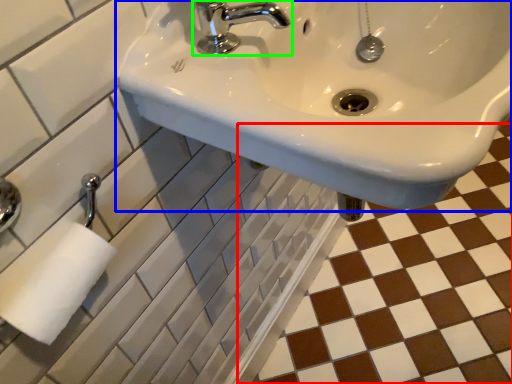
Question: Estimate the real-world distances between objects in this image. Which object is closer to ceramic tile (highlighted by a red box), sink (highlighted by a blue box) or tap (highlighted by a green box)?

Choices:
 (A) sink
 (B) tap

Answer: (A)